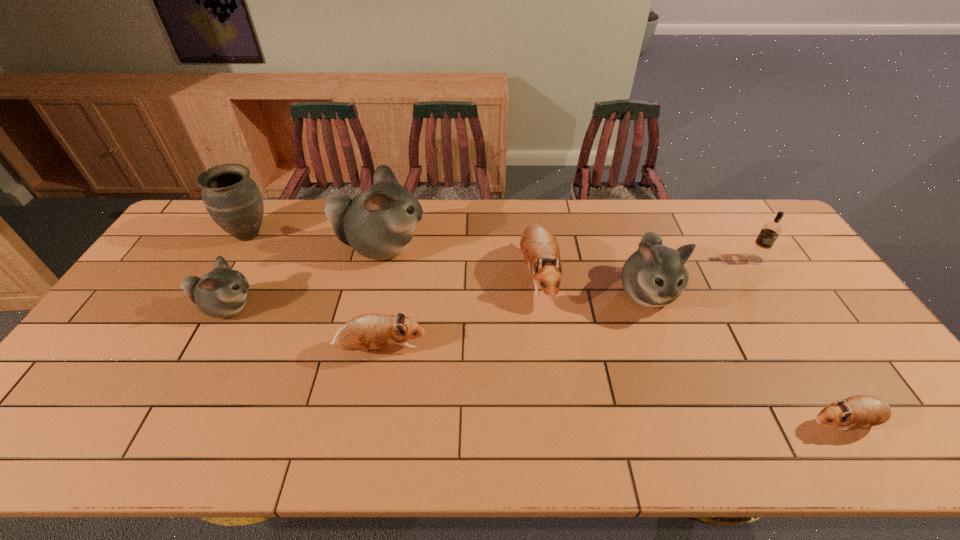
Where is `hamster that can be found as the fourth closest to the vodka`? The image size is (960, 540). hamster that can be found as the fourth closest to the vodka is located at coordinates (x=378, y=223).

Find the location of a particular element. The width and height of the screenshot is (960, 540). white hamster that is the nearest to the biggest white hamster is located at coordinates (223, 292).

Find the location of a particular element. white hamster that can be found as the closest to the leftmost white hamster is located at coordinates pos(378,223).

This screenshot has height=540, width=960. Identify the location of brown hamster identified as the third closest to the vodka. (365, 332).

You are a GUI agent. You are given a task and a screenshot of the screen. Output one action in this format:
    pyautogui.click(x=<x>, y=<y>)
    Task: Click on the closest brown hamster relative to the biggest brown hamster
    
    Given the screenshot: What is the action you would take?
    coord(365,332)

You are a GUI agent. You are given a task and a screenshot of the screen. Output one action in this format:
    pyautogui.click(x=<x>, y=<y>)
    Task: Click on the free location that satisfies the following two spatial constraints: 1. on the face of the second biggest white hamster; 2. at the face of the seventh farthest object
    
    Given the screenshot: What is the action you would take?
    [667, 349]

I want to click on blank space that satisfies the following two spatial constraints: 1. on the face of the rightmost white hamster; 2. at the face of the second shortest object, so click(x=667, y=349).

Find the location of a particular element. vacant space that satisfies the following two spatial constraints: 1. at the face of the biggest brown hamster; 2. on the face of the leftmost hamster is located at coordinates (541, 308).

At what (x,y) coordinates should I click in order to perform the action: click on free space that satisfies the following two spatial constraints: 1. on the label of the vodka; 2. at the face of the shortest hamster. Please return your answer as a coordinate pair (x, y). This screenshot has width=960, height=540. Looking at the image, I should click on (861, 423).